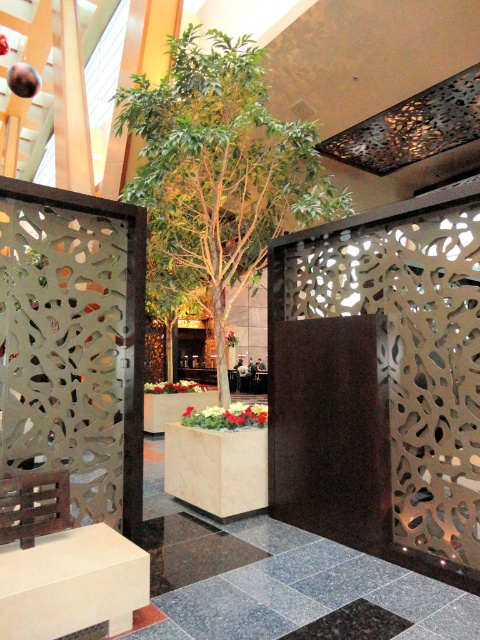
Question: Which point is closer to the camera?

Choices:
 (A) (173, 120)
 (B) (218, 417)

Answer: (A)

Question: Does green leafy plant at center appear on the left side of green matte planter at center?

Choices:
 (A) yes
 (B) no

Answer: (B)

Question: In this image, where is green leafy plant at center located relative to floral arrangement at center?

Choices:
 (A) right
 (B) left

Answer: (A)

Question: Is green leafy plant at center wider than green matte planter at center?

Choices:
 (A) no
 (B) yes

Answer: (B)

Question: Among these points, which one is farthest from the camera?

Choices:
 (A) (226, 74)
 (B) (186, 381)
 (C) (200, 420)

Answer: (B)

Question: Which of the following is the farthest from the observer?

Choices:
 (A) green leafy plant at center
 (B) green matte planter at center
 (C) floral arrangement at center

Answer: (B)